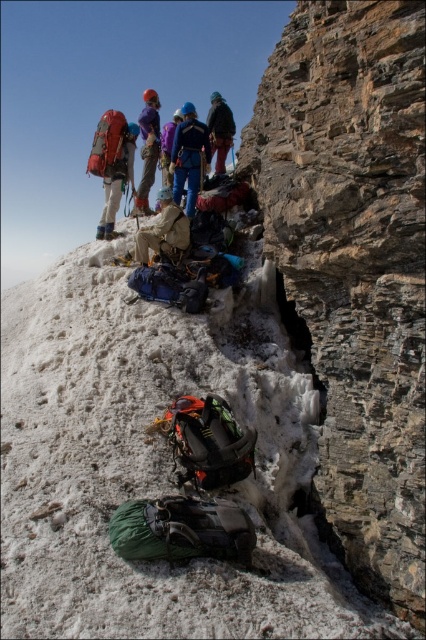
Question: Is blue fabric jacket at center smaller than purple fabric helmet at upper center?

Choices:
 (A) yes
 (B) no

Answer: (A)

Question: Which of the following is the closest to the observer?

Choices:
 (A) (201, 156)
 (B) (150, 134)
 (C) (215, 97)
 (D) (126, 138)

Answer: (A)

Question: Which point is closer to the camera taking this photo?

Choices:
 (A) (218, 172)
 (B) (144, 147)
 (C) (189, 186)
 (D) (132, 164)

Answer: (C)

Question: In this image, where is matte red backpack at upper left located relative to blue fabric jacket at center?

Choices:
 (A) left
 (B) right

Answer: (A)

Question: Estimate the real-world distances between objects in this image. Which object is closer to the purple fleece jacket at upper center?

Choices:
 (A) beige fabric jacket at center
 (B) matte red backpack at upper left
 (C) blue fabric jacket at center

Answer: (C)

Question: Does matte red backpack at upper left have a greater width compared to purple fleece jacket at upper center?

Choices:
 (A) yes
 (B) no

Answer: (B)